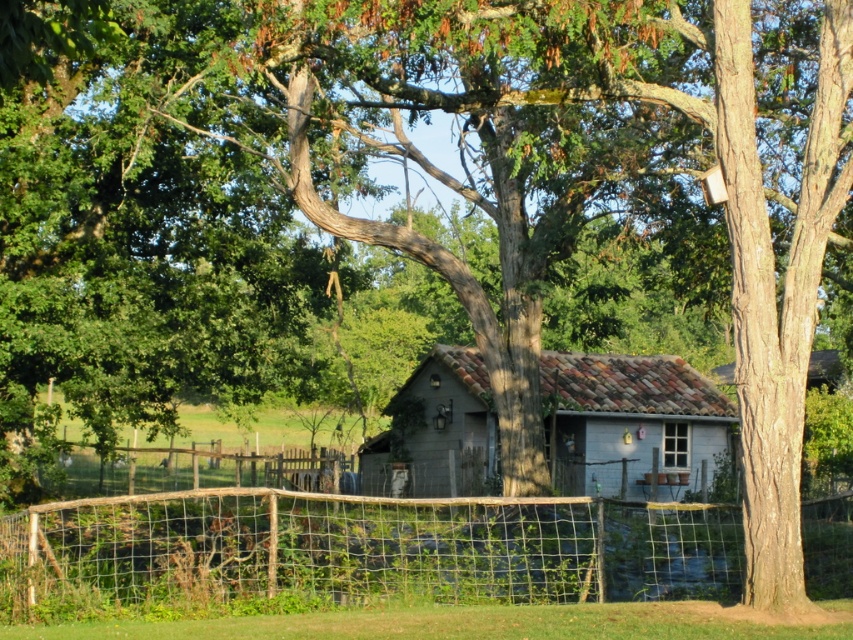
Where is `rustic wire mesh fence at lower center`? rustic wire mesh fence at lower center is located at coordinates (363, 548).

Does rustic wire mesh fence at lower center have a greater height compared to gray wood cabin at center?

In fact, rustic wire mesh fence at lower center may be shorter than gray wood cabin at center.

Describe the element at coordinates (363, 548) in the screenshot. I see `rustic wire mesh fence at lower center` at that location.

At what (x,y) coordinates should I click in order to perform the action: click on rustic wire mesh fence at lower center. Please return your answer as a coordinate pair (x, y). The height and width of the screenshot is (640, 853). Looking at the image, I should click on (363, 548).